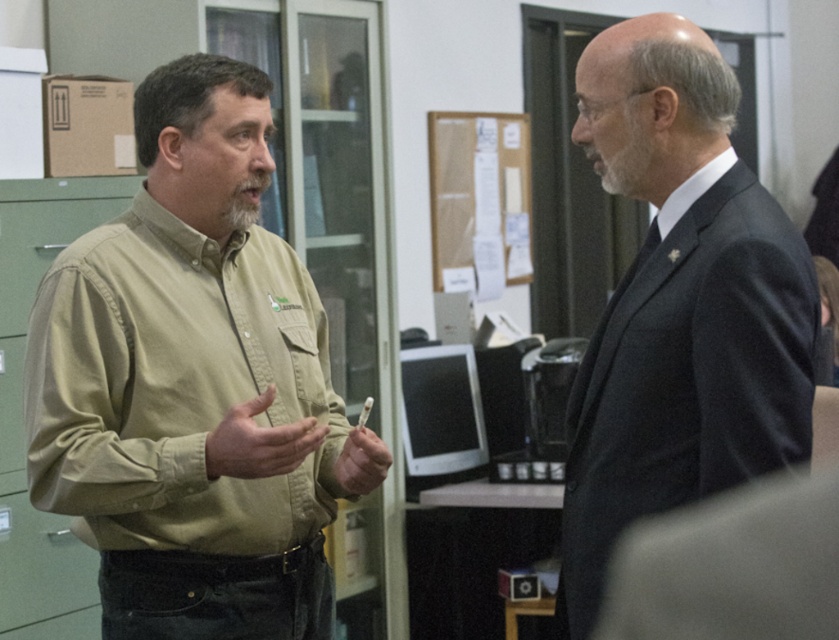
You are a delivery person standing at the entrance of the office. You need to deliver a package to the man wearing the dark gray suit at right. The package is 1.5 meters long. Can you hand him the package without moving closer than 1.5 meters from him?

The dark gray suit at right and the viewer are 1.56 meters apart. Since the package is 1.5 meters long, you can extend it towards him while maintaining the 1.5 meter distance, so yes, you can hand him the package without moving closer than 1.5 meters.

You are a photographer standing in front of the scene. You want to take a photo focusing on the point closer to the camera. Which point should you choose between point [611,570] and point [702,177]?

Point [611,570] is closer to the camera than point [702,177], so you should choose point [611,570].

You are a photographer setting up for a group photo. You need to arrange the green cotton shirt at left and the dark gray suit at right so that both are visible in the frame. Given their sizes, which person should you position closer to the camera to ensure both appear equally sized in the photo?

The green cotton shirt at left is larger in size than the dark gray suit at right. To make both appear equally sized in the photo, position the dark gray suit at right closer to the camera since it is smaller in real size and needs to be magnified to match the apparent size of the larger green cotton shirt at left.